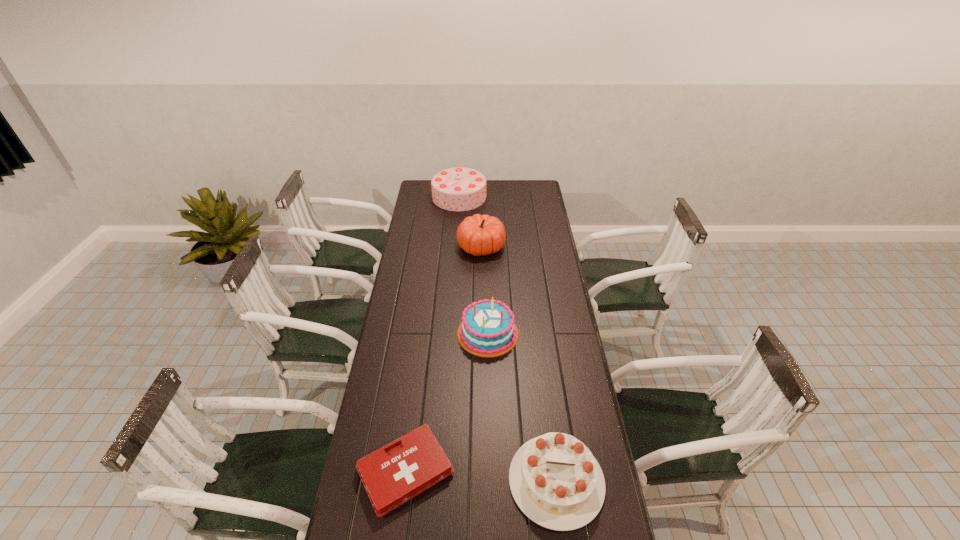
In order to click on the fourth closest object to the farthest birthday cake in this screenshot , I will do `click(555, 480)`.

Locate which object is the closest to the second farthest object. Please provide its 2D coordinates. Your answer should be formatted as a tuple, i.e. [(x, y)], where the tuple contains the x and y coordinates of a point satisfying the conditions above.

[(455, 189)]

Locate an element on the screen. Image resolution: width=960 pixels, height=540 pixels. the closest birthday cake to the second shortest birthday cake is located at coordinates (555, 480).

Find the location of a particular element. This screenshot has height=540, width=960. birthday cake that stands as the closest to the tallest object is located at coordinates (487, 329).

Identify the location of free space that satisfies the following two spatial constraints: 1. on the back side of the second shortest birthday cake; 2. on the right side of the shortest object. The width and height of the screenshot is (960, 540). (423, 333).

I want to click on free space in the image that satisfies the following two spatial constraints: 1. on the back side of the first-aid kit; 2. on the right side of the farthest birthday cake, so click(441, 197).